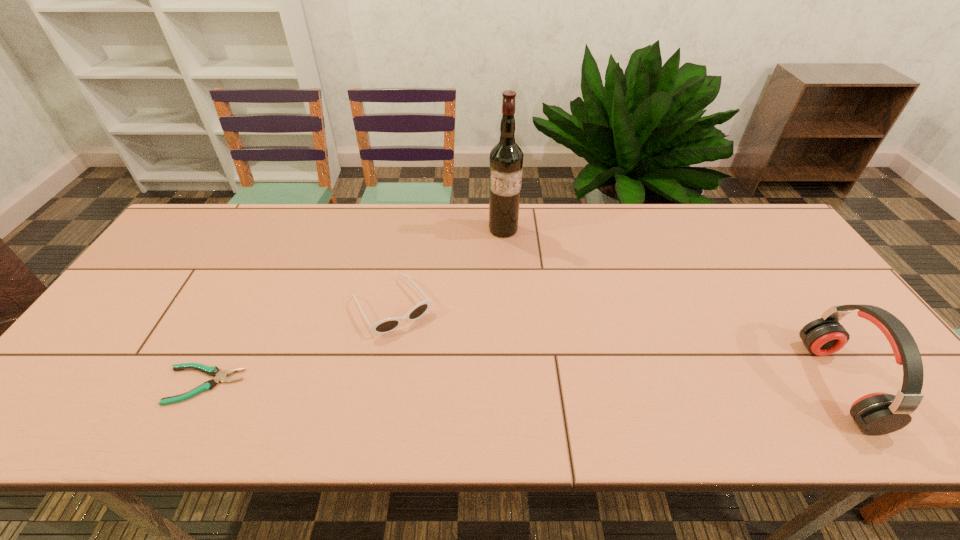
You are a GUI agent. You are given a task and a screenshot of the screen. Output one action in this format:
    pyautogui.click(x=<x>, y=<y>)
    Task: Click on the earphone at the near edge
    The image size is (960, 540).
    Given the screenshot: What is the action you would take?
    pyautogui.click(x=879, y=413)

This screenshot has width=960, height=540. I want to click on object at the right edge, so click(879, 413).

Identify the location of object at the near right corner. (879, 413).

Where is `vacant space at the far edge of the desktop`? The width and height of the screenshot is (960, 540). vacant space at the far edge of the desktop is located at coordinates (339, 229).

Where is `vacant space at the near edge of the desktop`? This screenshot has width=960, height=540. vacant space at the near edge of the desktop is located at coordinates (477, 387).

Locate an element on the screen. Image resolution: width=960 pixels, height=540 pixels. free space at the right edge is located at coordinates (790, 286).

Where is `vacant space at the far left corner`? Image resolution: width=960 pixels, height=540 pixels. vacant space at the far left corner is located at coordinates (193, 248).

This screenshot has height=540, width=960. In the image, there is a desktop. Find the location of `vacant space at the far right corner`. vacant space at the far right corner is located at coordinates (751, 218).

Identify the location of vacant space that is in between the third object from right to left and the shortest object. This screenshot has width=960, height=540. (298, 346).

Locate an element on the screen. blank region between the third tallest object and the wine bottle is located at coordinates (447, 268).